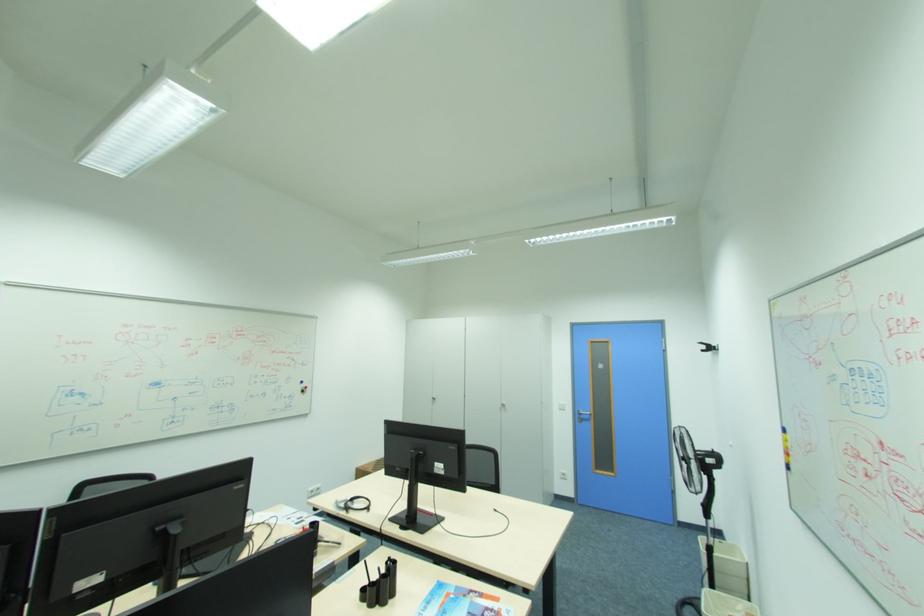
Describe the element at coordinates (505, 406) in the screenshot. This screenshot has width=924, height=616. I see `a cabinet handle` at that location.